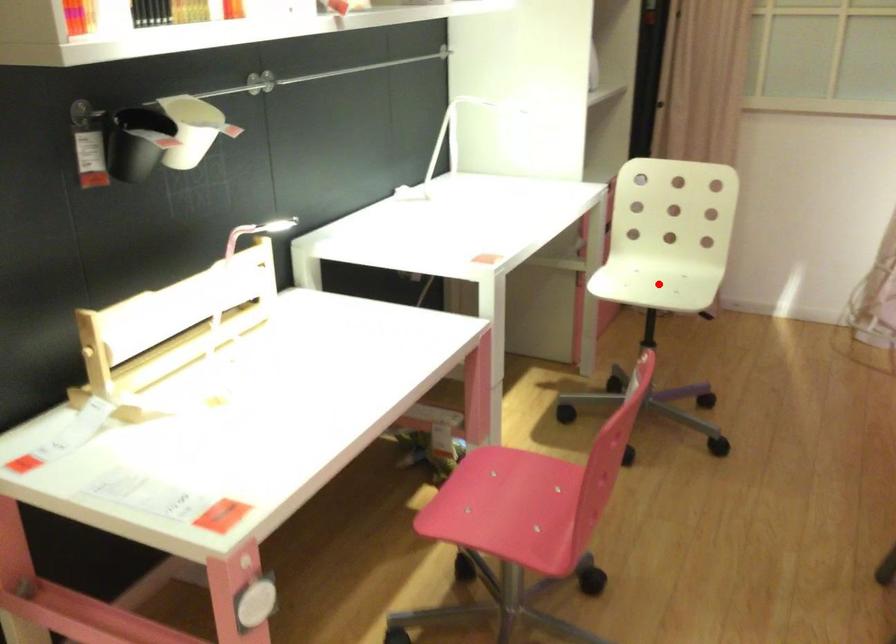
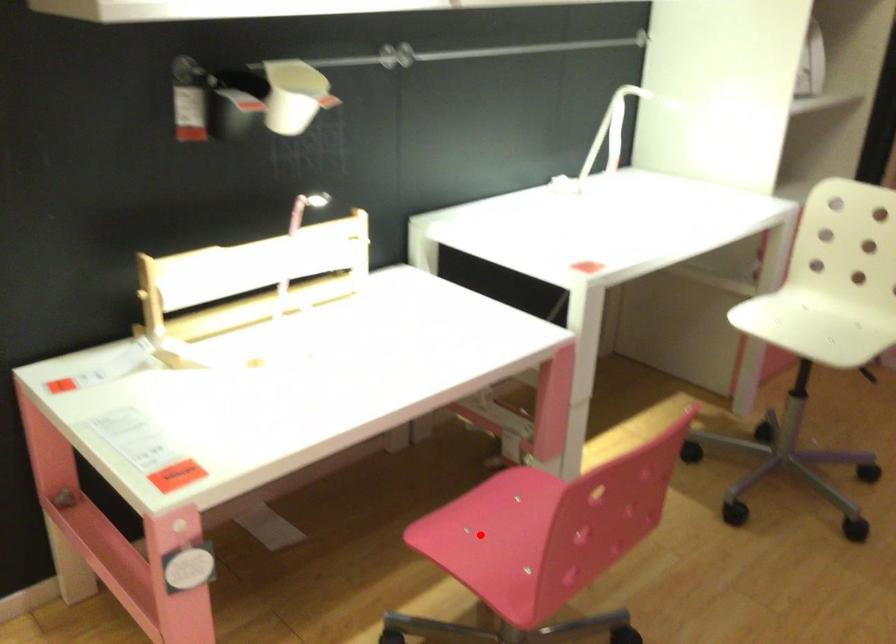
I am providing you with two images of the same scene from different viewpoints. A red point is marked on the first image and another point is marked on the second image. Is the red point in image1 aligned with the point shown in image2?

No